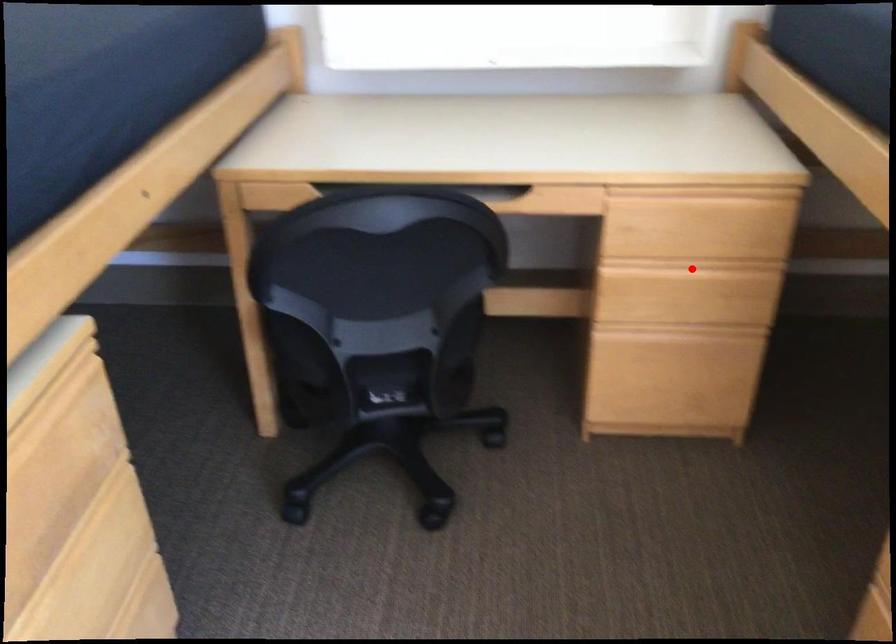
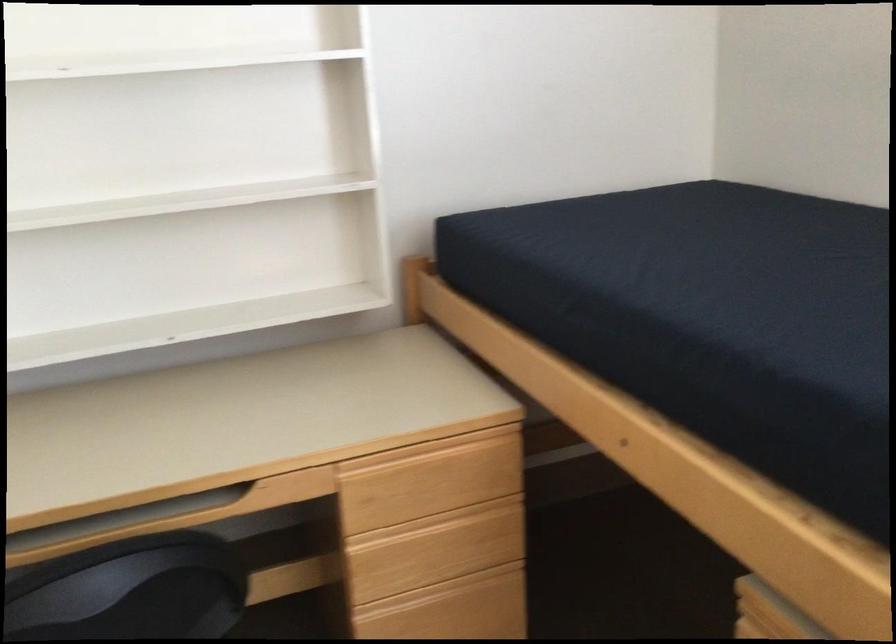
The point at the highlighted location is marked in the first image. Where is the corresponding point in the second image?

(443, 524)